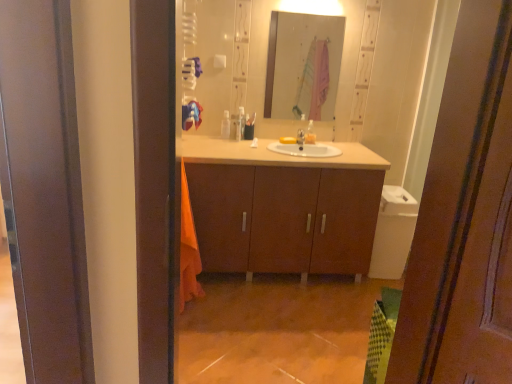
Question: Could you tell me if matte wood cabinet at center is facing clear glass mirror at upper center?

Choices:
 (A) no
 (B) yes

Answer: (A)

Question: Considering the relative sizes of matte wood cabinet at center and clear glass mirror at upper center in the image provided, is matte wood cabinet at center wider than clear glass mirror at upper center?

Choices:
 (A) yes
 (B) no

Answer: (A)

Question: Does matte wood cabinet at center have a larger size compared to clear glass mirror at upper center?

Choices:
 (A) no
 (B) yes

Answer: (B)

Question: From a real-world perspective, is matte wood cabinet at center located higher than clear glass mirror at upper center?

Choices:
 (A) no
 (B) yes

Answer: (A)

Question: Is matte wood cabinet at center not close to clear glass mirror at upper center?

Choices:
 (A) no
 (B) yes

Answer: (B)

Question: Considering the positions of point 185,228 and point 227,112, is point 185,228 closer or farther from the camera than point 227,112?

Choices:
 (A) closer
 (B) farther

Answer: (A)

Question: In terms of height, does orange cotton beach towel at left, acting as the second beach towel starting from the top, look taller or shorter compared to white plastic container at center, the 3th toiletry positioned from the right?

Choices:
 (A) tall
 (B) short

Answer: (A)

Question: Based on their sizes in the image, would you say orange cotton beach towel at left, acting as the 1th beach towel starting from the bottom, is bigger or smaller than white plastic container at center, which is counted as the 1th toiletry, starting from the left?

Choices:
 (A) small
 (B) big

Answer: (B)

Question: Which is correct: orange cotton beach towel at left, acting as the 1th beach towel starting from the bottom, is inside white plastic container at center, which is counted as the 1th toiletry, starting from the left, or outside of it?

Choices:
 (A) inside
 (B) outside

Answer: (B)

Question: From a real-world perspective, is translucent plastic bag at center, arranged as the 3th toiletry when viewed from the left, physically located above or below clear glass mirror at upper center?

Choices:
 (A) below
 (B) above

Answer: (A)

Question: From the image's perspective, is translucent plastic bag at center, the first toiletry from the right, located above or below clear glass mirror at upper center?

Choices:
 (A) above
 (B) below

Answer: (B)

Question: Which is correct: translucent plastic bag at center, arranged as the 3th toiletry when viewed from the left, is inside clear glass mirror at upper center, or outside of it?

Choices:
 (A) inside
 (B) outside

Answer: (B)

Question: Visually, is translucent plastic bag at center, arranged as the 3th toiletry when viewed from the left, positioned to the left or to the right of clear glass mirror at upper center?

Choices:
 (A) right
 (B) left

Answer: (A)

Question: Considering the positions of matte wood cabinet at center and silver metallic tap at center in the image, is matte wood cabinet at center bigger or smaller than silver metallic tap at center?

Choices:
 (A) big
 (B) small

Answer: (A)

Question: Is point (306, 162) closer or farther from the camera than point (296, 139)?

Choices:
 (A) closer
 (B) farther

Answer: (A)